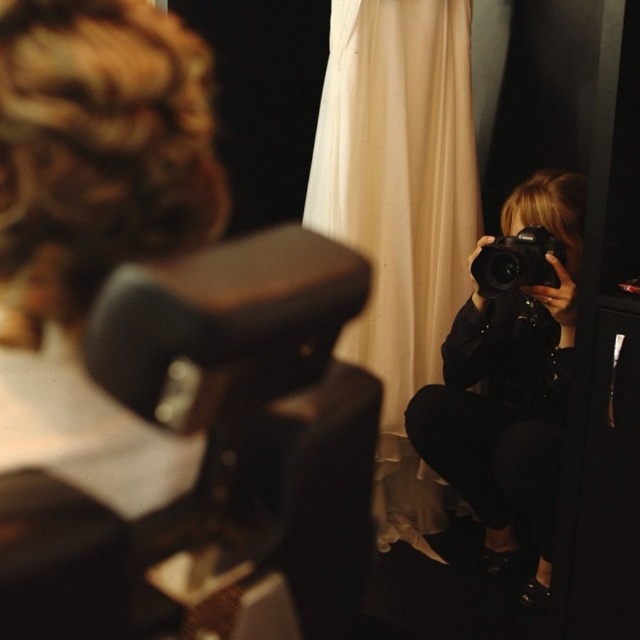
Does white fabric curtain at center have a lesser height compared to black plastic camera at right?

Incorrect, white fabric curtain at center's height does not fall short of black plastic camera at right's.

Who is shorter, white fabric curtain at center or black plastic camera at right?

black plastic camera at right is shorter.

This screenshot has width=640, height=640. I want to click on white fabric curtain at center, so click(x=400, y=214).

Is black matte camera at center positioned behind black plastic camera at right?

Yes, black matte camera at center is further from the viewer.

The height and width of the screenshot is (640, 640). What do you see at coordinates (509, 388) in the screenshot?
I see `black matte camera at center` at bounding box center [509, 388].

Looking at this image, measure the distance between black matte camera at center and camera.

5.12 feet

This screenshot has width=640, height=640. Find the location of `black matte camera at center`. black matte camera at center is located at coordinates [509, 388].

Who is positioned more to the right, white fabric curtain at center or black matte camera at center?

black matte camera at center is more to the right.

In the scene shown: Between white fabric curtain at center and black matte camera at center, which one has more height?

white fabric curtain at center is taller.

Identify the location of white fabric curtain at center. (400, 214).